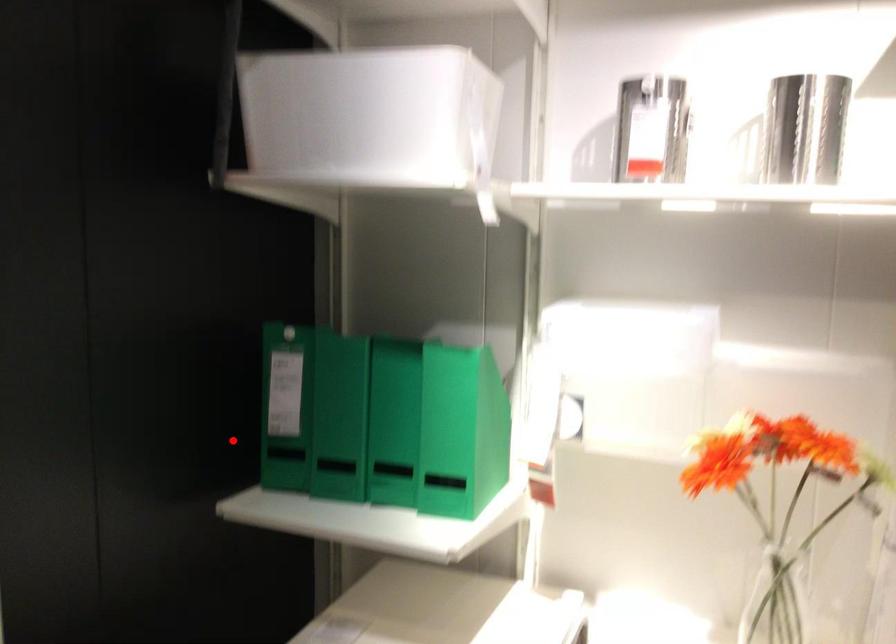
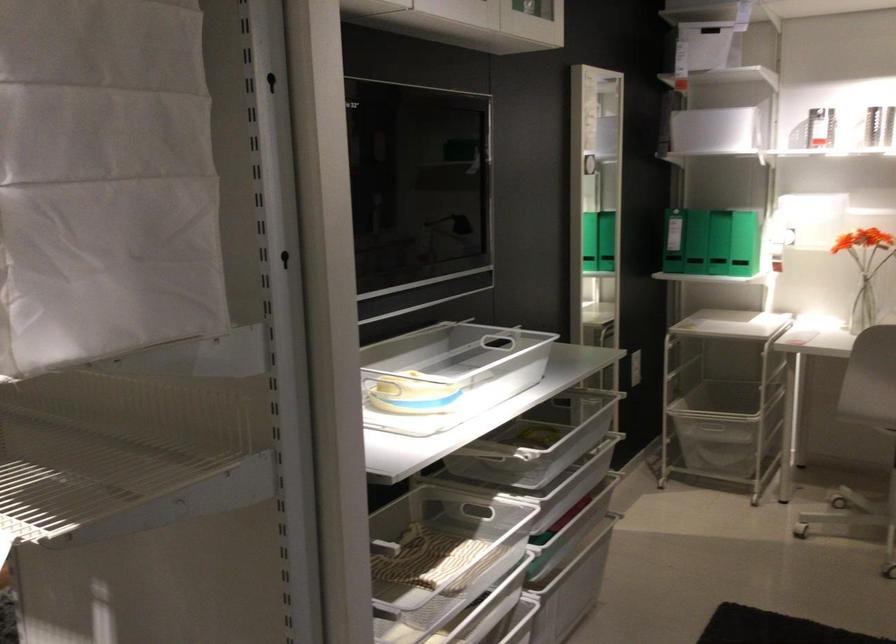
Question: A red point is marked in image1. In image2, is the corresponding 3D point closer to the camera or farther? Reply with the corresponding letter.

Choices:
 (A) The corresponding 3D point is closer.
 (B) The corresponding 3D point is farther.

Answer: (B)